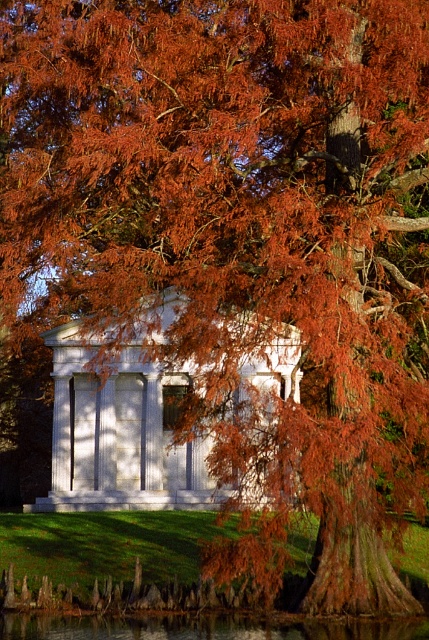
Is white marble gazebo at center above transparent water at lower center?

Correct, white marble gazebo at center is located above transparent water at lower center.

Is white marble gazebo at center shorter than transparent water at lower center?

No.

Describe the element at coordinates (121, 433) in the screenshot. The height and width of the screenshot is (640, 429). I see `white marble gazebo at center` at that location.

The image size is (429, 640). I want to click on white marble gazebo at center, so click(121, 433).